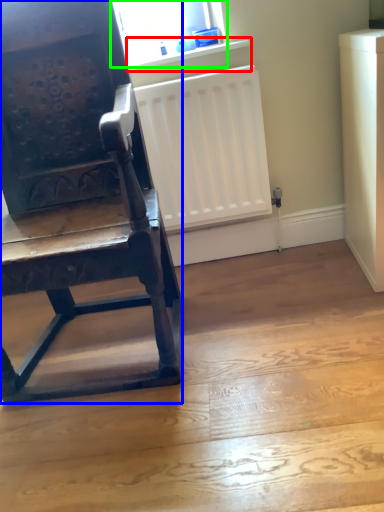
Question: Which object is the farthest from window sill (highlighted by a red box)? Choose among these: chair (highlighted by a blue box) or window screen (highlighted by a green box).

Choices:
 (A) chair
 (B) window screen

Answer: (A)